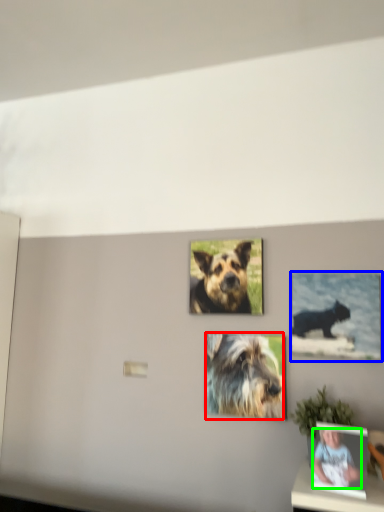
Question: Estimate the real-world distances between objects in this image. Which object is farther from dog (highlighted by a red box), picture frame (highlighted by a blue box) or person (highlighted by a green box)?

Choices:
 (A) picture frame
 (B) person

Answer: (B)